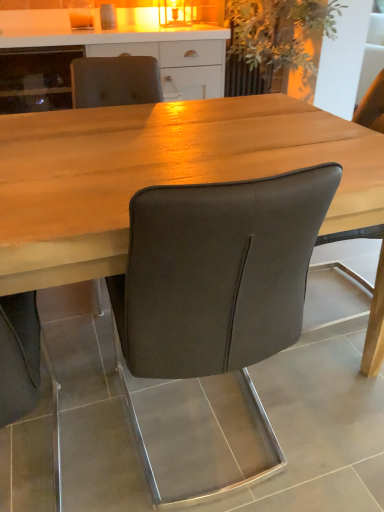
Question: Is green leafy plant at upper center positioned with its back to matte white cabinet at upper center?

Choices:
 (A) no
 (B) yes

Answer: (A)

Question: Is green leafy plant at upper center taller than matte white cabinet at upper center?

Choices:
 (A) no
 (B) yes

Answer: (B)

Question: Considering the relative sizes of green leafy plant at upper center and matte white cabinet at upper center in the image provided, is green leafy plant at upper center smaller than matte white cabinet at upper center?

Choices:
 (A) no
 (B) yes

Answer: (A)

Question: Considering the relative sizes of green leafy plant at upper center and matte white cabinet at upper center in the image provided, is green leafy plant at upper center wider than matte white cabinet at upper center?

Choices:
 (A) no
 (B) yes

Answer: (A)

Question: Is matte white cabinet at upper center located within green leafy plant at upper center?

Choices:
 (A) yes
 (B) no

Answer: (B)

Question: Is point (246, 15) closer or farther from the camera than point (225, 373)?

Choices:
 (A) farther
 (B) closer

Answer: (A)

Question: Is green leafy plant at upper center wider or thinner than dark gray leather chair at center?

Choices:
 (A) wide
 (B) thin

Answer: (A)

Question: Would you say green leafy plant at upper center is inside or outside dark gray leather chair at center?

Choices:
 (A) outside
 (B) inside

Answer: (A)

Question: From a real-world perspective, is green leafy plant at upper center physically located above or below dark gray leather chair at center?

Choices:
 (A) above
 (B) below

Answer: (A)

Question: From the image's perspective, is matte white cabinet at upper center located above or below green leafy plant at upper center?

Choices:
 (A) below
 (B) above

Answer: (A)

Question: In terms of height, does matte white cabinet at upper center look taller or shorter compared to green leafy plant at upper center?

Choices:
 (A) tall
 (B) short

Answer: (B)

Question: Visually, is matte white cabinet at upper center positioned to the left or to the right of green leafy plant at upper center?

Choices:
 (A) right
 (B) left

Answer: (B)

Question: Is matte white cabinet at upper center bigger or smaller than green leafy plant at upper center?

Choices:
 (A) small
 (B) big

Answer: (A)

Question: From a real-world perspective, relative to dark gray leather chair at center, is wooden table at center vertically above or below?

Choices:
 (A) above
 (B) below

Answer: (B)

Question: Based on their positions, is wooden table at center located to the left or right of dark gray leather chair at center?

Choices:
 (A) left
 (B) right

Answer: (A)